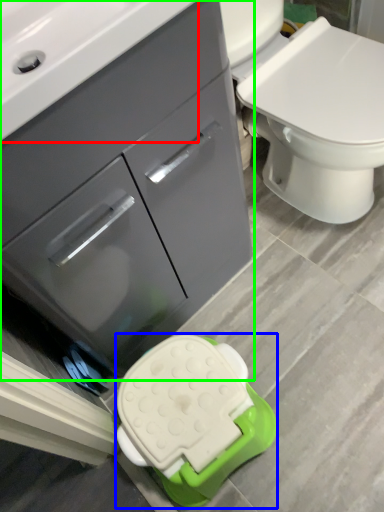
Question: Which is nearer to the sink (highlighted by a red box)? porcelain (highlighted by a blue box) or bathroom cabinet (highlighted by a green box).

Choices:
 (A) porcelain
 (B) bathroom cabinet

Answer: (B)